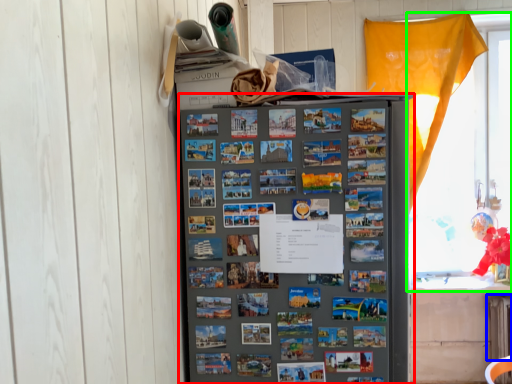
Question: Estimate the real-world distances between objects in this image. Which object is closer to refrigerator (highlighted by a red box), radiator (highlighted by a blue box) or window (highlighted by a green box)?

Choices:
 (A) radiator
 (B) window

Answer: (B)